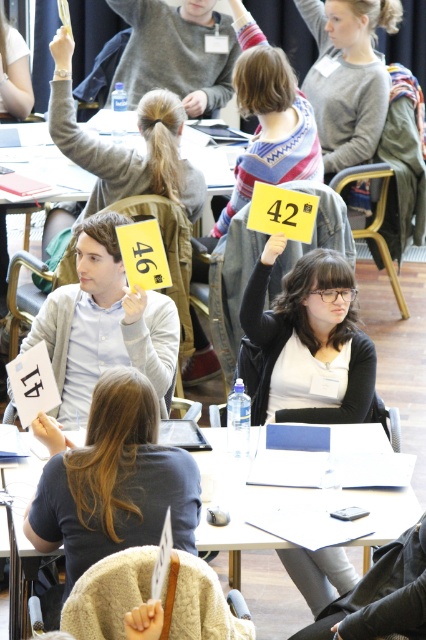
Is matte black card at center to the right of matte gray sweater at upper center from the viewer's perspective?

Indeed, matte black card at center is positioned on the right side of matte gray sweater at upper center.

Is point (351, 280) closer to viewer compared to point (161, 12)?

Yes.

Describe the element at coordinates (305, 342) in the screenshot. I see `matte black card at center` at that location.

Identify the location of matte black card at center. (305, 342).

Measure the distance from dark gray sweater at center to matte gray sweater at upper center.

They are 4.56 meters apart.

Identify the location of dark gray sweater at center. Image resolution: width=426 pixels, height=640 pixels. (115, 481).

Does point (48, 529) come closer to viewer compared to point (204, 524)?

Yes.

Which is behind, point (169, 477) or point (249, 573)?

The point (249, 573) is more distant.

At what (x,y) coordinates should I click in order to perform the action: click on dark gray sweater at center. Please return your answer as a coordinate pair (x, y). The width and height of the screenshot is (426, 640). Looking at the image, I should click on (115, 481).